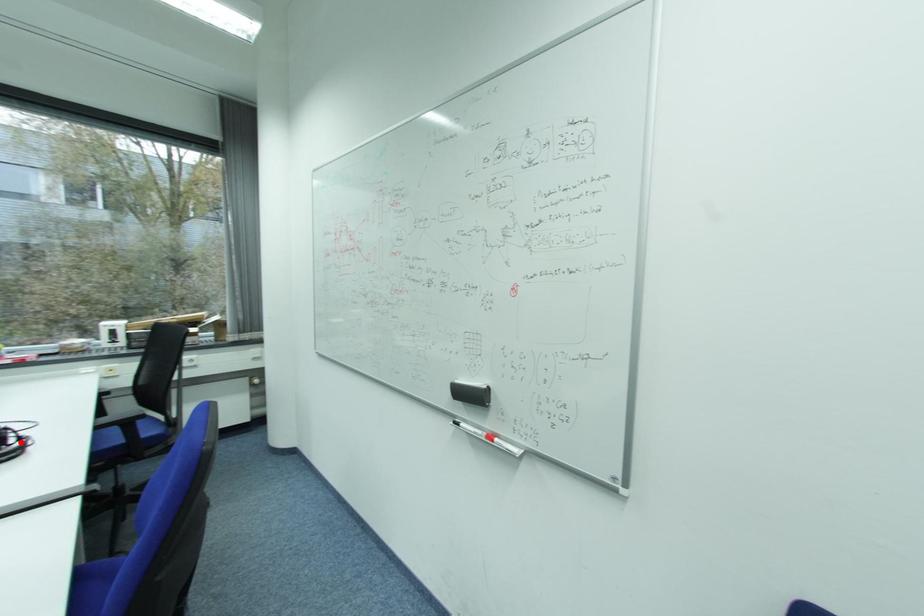
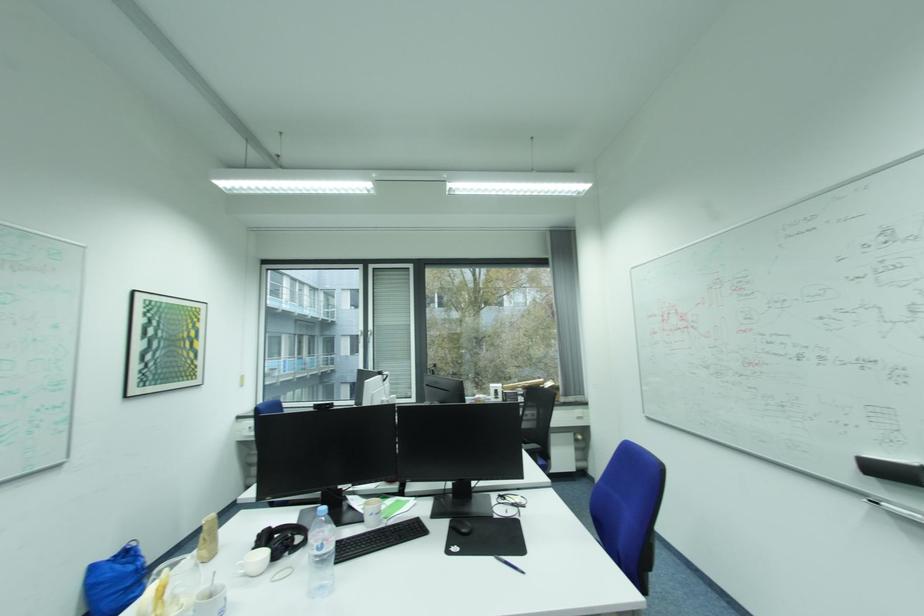
Question: I am providing you with two images of the same scene from different viewpoints. A red point is marked on the first image. At the location where the point appears in image 1, is it still visible in image 2?

Choices:
 (A) Yes
 (B) No

Answer: (B)